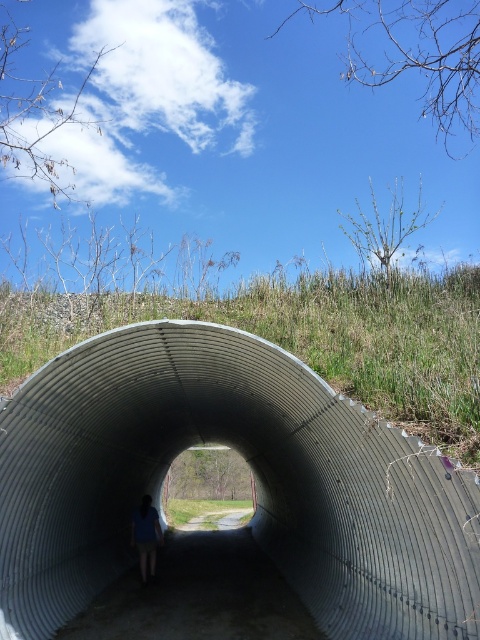
You are a photographer trying to capture the metallic silver tunnel at center and the blue fabric shirt at center in a single frame. Which object should you focus on first if you want to ensure both are in the frame without moving the camera?

The metallic silver tunnel at center is larger in size than blue fabric shirt at center, so you should focus on the metallic silver tunnel at center first to ensure it fits within the frame before adjusting for the smaller blue fabric shirt at center.

You are standing at point A, which is located at coordinates (253,477). Looking around, you see a metallic silver tunnel at center. Which direction should you walk to exit the tunnel and reach the bright, sunny area outside?

You should walk towards the entrance of the metallic silver tunnel at center, as the entrance leads to the bright, sunny area outside described in the scene.